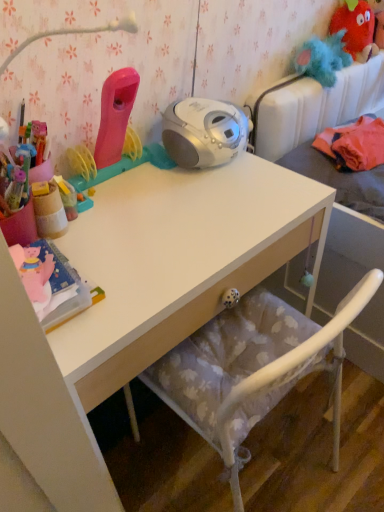
Locate an element on the screen. The height and width of the screenshot is (512, 384). empty space that is ontop of white matte desk at center (from a real-world perspective) is located at coordinates (167, 215).